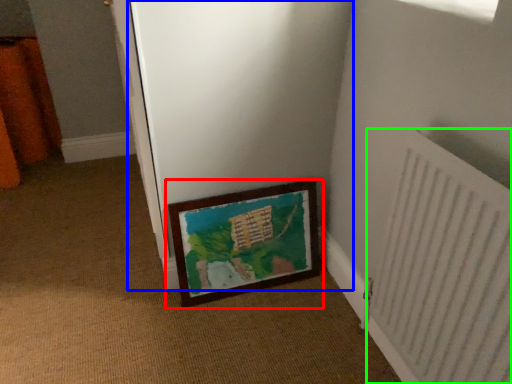
Question: Which object is the farthest from picture frame (highlighted by a red box)? Choose among these: screen door (highlighted by a blue box) or radiator (highlighted by a green box).

Choices:
 (A) screen door
 (B) radiator

Answer: (B)